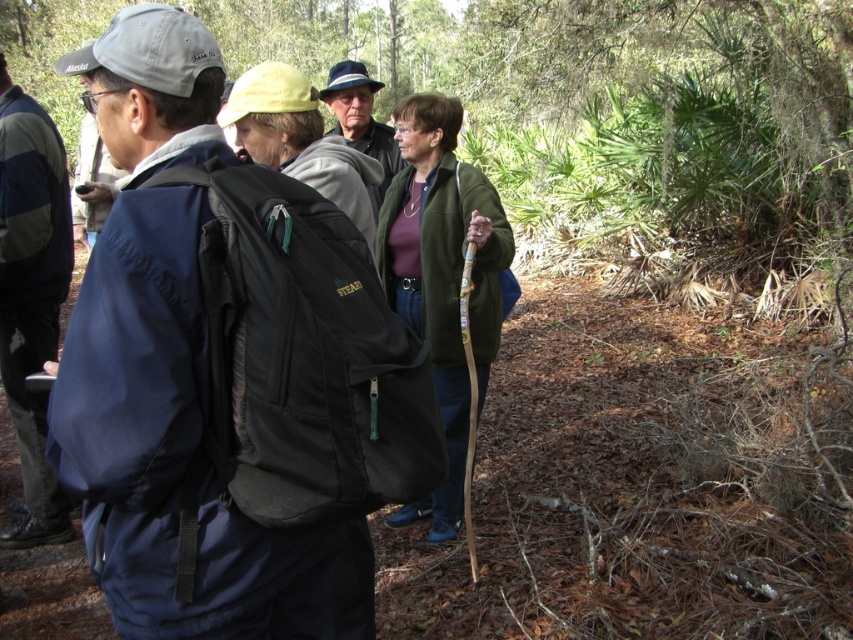
Question: Among these objects, which one is farthest from the camera?

Choices:
 (A) matte blue jacket at left
 (B) matte black hat at upper center
 (C) green woolen jacket at center
 (D) dark blue fabric jacket at left

Answer: (B)

Question: Estimate the real-world distances between objects in this image. Which object is closer to the matte blue jacket at left?

Choices:
 (A) matte black hat at upper center
 (B) green woolen jacket at center
 (C) dark blue fabric jacket at left

Answer: (B)

Question: Is matte blue jacket at left above matte black hat at upper center?

Choices:
 (A) no
 (B) yes

Answer: (A)

Question: Can you confirm if green woolen jacket at center is thinner than matte black hat at upper center?

Choices:
 (A) yes
 (B) no

Answer: (B)

Question: Can you confirm if green woolen jacket at center is positioned to the right of matte black hat at upper center?

Choices:
 (A) no
 (B) yes

Answer: (B)

Question: Among these objects, which one is nearest to the camera?

Choices:
 (A) green woolen jacket at center
 (B) dark blue fabric jacket at left
 (C) matte blue jacket at left
 (D) matte black hat at upper center

Answer: (C)